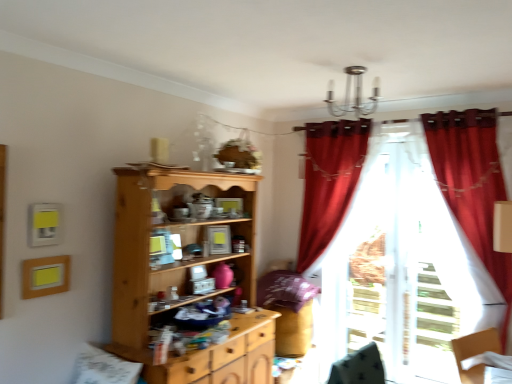
How much space does translucent white curtain at right, which appears as the first curtain when viewed from the back, occupy vertically?

2.07 meters.

What do you see at coordinates (472, 185) in the screenshot? The height and width of the screenshot is (384, 512). I see `velvet red curtain at right, the second curtain when ordered from back to front` at bounding box center [472, 185].

Find the location of `translucent white curtain at right, which appears as the first curtain when viewed from the back`. translucent white curtain at right, which appears as the first curtain when viewed from the back is located at coordinates (407, 261).

Could you measure the distance between velvet red curtain at right, the second curtain when ordered from back to front, and light wood cupboard at center?

velvet red curtain at right, the second curtain when ordered from back to front, is 5.51 feet from light wood cupboard at center.

From a real-world perspective, is velvet red curtain at right, the second curtain when ordered from back to front, over light wood cupboard at center?

Yes, from a real-world perspective, velvet red curtain at right, the second curtain when ordered from back to front, is over light wood cupboard at center

In terms of height, does velvet red curtain at right, the second curtain when ordered from back to front, look taller or shorter compared to light wood cupboard at center?

Considering their sizes, velvet red curtain at right, the second curtain when ordered from back to front, has more height than light wood cupboard at center.

In the image, is velvet red curtain at right, which ranks as the first curtain in front-to-back order, positioned in front of or behind light wood cupboard at center?

In the image, velvet red curtain at right, which ranks as the first curtain in front-to-back order, appears behind light wood cupboard at center.

Is translucent white curtain at right, which appears as the first curtain when viewed from the back, smaller than light wood cupboard at center?

Yes, translucent white curtain at right, which appears as the first curtain when viewed from the back, is smaller than light wood cupboard at center.

Does point (406, 306) appear closer or farther from the camera than point (184, 180)?

Clearly, point (406, 306) is more distant from the camera than point (184, 180).

From the image's perspective, is translucent white curtain at right, the 2th curtain positioned from the front, located above light wood cupboard at center?

Yes.

Consider the image. Is velvet red curtain at right, the second curtain when ordered from back to front, shorter than translucent white curtain at right, which appears as the first curtain when viewed from the back?

Yes, velvet red curtain at right, the second curtain when ordered from back to front, is shorter than translucent white curtain at right, which appears as the first curtain when viewed from the back.

Which is in front, point (490, 189) or point (325, 284)?

The point (490, 189) is closer to the camera.

From the image's perspective, which one is positioned higher, velvet red curtain at right, which ranks as the first curtain in front-to-back order, or translucent white curtain at right, the 2th curtain positioned from the front?

velvet red curtain at right, which ranks as the first curtain in front-to-back order, appears higher in the image.

How distant is velvet red curtain at right, the second curtain when ordered from back to front, from translucent white curtain at right, the 2th curtain positioned from the front?

A distance of 17.65 inches exists between velvet red curtain at right, the second curtain when ordered from back to front, and translucent white curtain at right, the 2th curtain positioned from the front.

Does translucent white curtain at right, the 2th curtain positioned from the front, have a lesser height compared to velvet red curtain at right, the second curtain when ordered from back to front?

In fact, translucent white curtain at right, the 2th curtain positioned from the front, may be taller than velvet red curtain at right, the second curtain when ordered from back to front.

Is translucent white curtain at right, the 2th curtain positioned from the front, in front of velvet red curtain at right, the second curtain when ordered from back to front?

No.

Considering the relative sizes of translucent white curtain at right, which appears as the first curtain when viewed from the back, and velvet red curtain at right, the second curtain when ordered from back to front, in the image provided, is translucent white curtain at right, which appears as the first curtain when viewed from the back, smaller than velvet red curtain at right, the second curtain when ordered from back to front,?

Indeed, translucent white curtain at right, which appears as the first curtain when viewed from the back, has a smaller size compared to velvet red curtain at right, the second curtain when ordered from back to front.

Is point (369, 155) positioned after point (445, 188)?

Yes, it is.

From the picture: From a real-world perspective, is light wood cupboard at center positioned above or below translucent white curtain at right, which appears as the first curtain when viewed from the back?

In terms of real-world spatial position, light wood cupboard at center is below translucent white curtain at right, which appears as the first curtain when viewed from the back.

Who is shorter, light wood cupboard at center or translucent white curtain at right, which appears as the first curtain when viewed from the back?

light wood cupboard at center is shorter.

Which is in front, point (233, 236) or point (413, 132)?

The point (233, 236) is closer to the camera.

Is light wood cupboard at center closer to camera compared to translucent white curtain at right, the 2th curtain positioned from the front?

Yes, light wood cupboard at center is in front of translucent white curtain at right, the 2th curtain positioned from the front.

Is light wood cupboard at center facing towards velvet red curtain at right, which ranks as the first curtain in front-to-back order?

No, light wood cupboard at center is not facing towards velvet red curtain at right, which ranks as the first curtain in front-to-back order.

Which of these two, light wood cupboard at center or velvet red curtain at right, the second curtain when ordered from back to front, stands shorter?

light wood cupboard at center is shorter.

From a real-world perspective, which is physically above, light wood cupboard at center or velvet red curtain at right, which ranks as the first curtain in front-to-back order?

velvet red curtain at right, which ranks as the first curtain in front-to-back order.

Locate an element on the screen. The height and width of the screenshot is (384, 512). the 2nd curtain to the right of the light wood cupboard at center, starting your count from the anchor is located at coordinates (472, 185).

Identify the location of cupboard that is in front of the velvet red curtain at right, the second curtain when ordered from back to front. point(182,273).

Identify the location of the 2nd curtain behind the light wood cupboard at center, counting from the anchor's position. This screenshot has height=384, width=512. (407, 261).

From the image, which object appears to be nearer to translucent white curtain at right, the 2th curtain positioned from the front, light wood cupboard at center or velvet red curtain at right, which ranks as the first curtain in front-to-back order?

velvet red curtain at right, which ranks as the first curtain in front-to-back order, is closer to translucent white curtain at right, the 2th curtain positioned from the front.

Which object lies nearer to the anchor point velvet red curtain at right, which ranks as the first curtain in front-to-back order, translucent white curtain at right, which appears as the first curtain when viewed from the back, or light wood cupboard at center?

The object closer to velvet red curtain at right, which ranks as the first curtain in front-to-back order, is translucent white curtain at right, which appears as the first curtain when viewed from the back.

Considering their positions, is velvet red curtain at right, the second curtain when ordered from back to front, positioned closer to light wood cupboard at center than translucent white curtain at right, which appears as the first curtain when viewed from the back?

translucent white curtain at right, which appears as the first curtain when viewed from the back, is closer to light wood cupboard at center.

Based on their spatial positions, is velvet red curtain at right, which ranks as the first curtain in front-to-back order, or light wood cupboard at center further from translucent white curtain at right, the 2th curtain positioned from the front?

light wood cupboard at center is further to translucent white curtain at right, the 2th curtain positioned from the front.

Which object lies nearer to the anchor point velvet red curtain at right, the second curtain when ordered from back to front, light wood cupboard at center or translucent white curtain at right, the 2th curtain positioned from the front?

translucent white curtain at right, the 2th curtain positioned from the front, lies closer to velvet red curtain at right, the second curtain when ordered from back to front, than the other object.

When comparing their distances from light wood cupboard at center, does translucent white curtain at right, the 2th curtain positioned from the front, or velvet red curtain at right, the second curtain when ordered from back to front, seem further?

velvet red curtain at right, the second curtain when ordered from back to front.

Locate an element on the screen. curtain situated between light wood cupboard at center and velvet red curtain at right, which ranks as the first curtain in front-to-back order, from left to right is located at coordinates (407, 261).